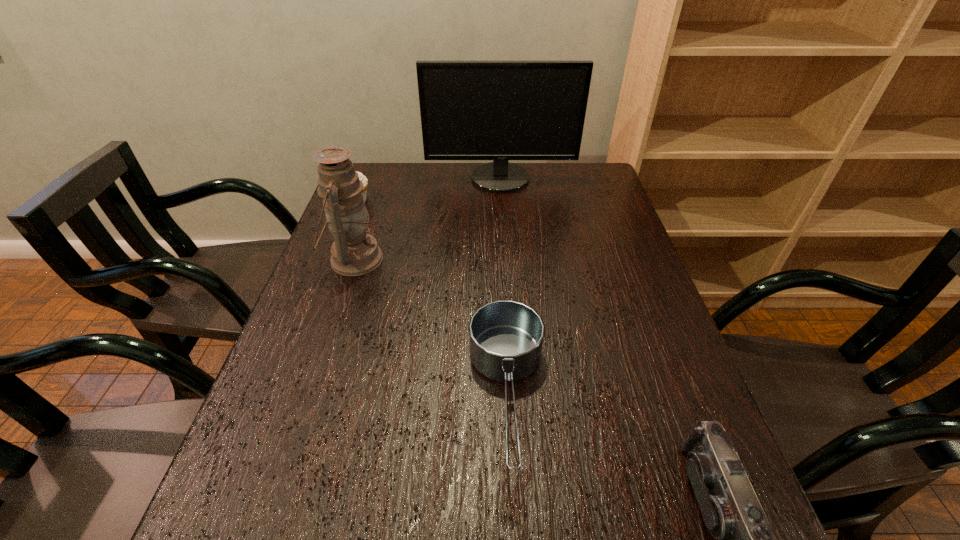
Image resolution: width=960 pixels, height=540 pixels. I want to click on free location at the far right corner of the desktop, so click(560, 167).

At what (x,y) coordinates should I click in order to perform the action: click on vacant area that lies between the monitor and the third nearest object. Please return your answer as a coordinate pair (x, y). The height and width of the screenshot is (540, 960). Looking at the image, I should click on (427, 219).

Identify the location of free space between the muffin and the saucepan. The image size is (960, 540). (433, 298).

Locate an element on the screen. vacant area that lies between the tallest object and the saucepan is located at coordinates (504, 287).

The width and height of the screenshot is (960, 540). In order to click on free space between the saucepan and the muffin in this screenshot , I will do `click(433, 298)`.

At what (x,y) coordinates should I click in order to perform the action: click on unoccupied area between the monitor and the fourth shortest object. Please return your answer as a coordinate pair (x, y). This screenshot has width=960, height=540. Looking at the image, I should click on (427, 219).

Find the location of a particular element. The image size is (960, 540). object that can be found as the second closest to the third nearest object is located at coordinates click(x=470, y=110).

This screenshot has width=960, height=540. Find the location of `object that is the fourth closest to the muffin`. object that is the fourth closest to the muffin is located at coordinates (731, 510).